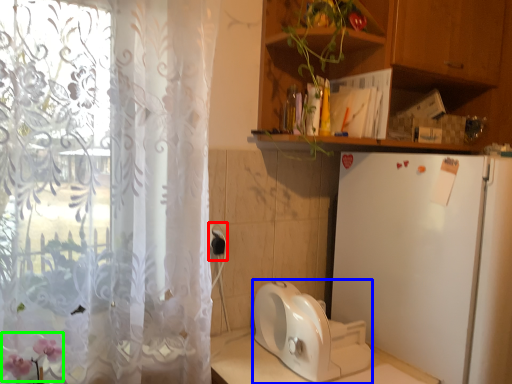
Question: Based on their relative distances, which object is farther from electric outlet (highlighted by a red box)? Choose from appliance (highlighted by a blue box) and flower (highlighted by a green box).

Choices:
 (A) appliance
 (B) flower

Answer: (B)